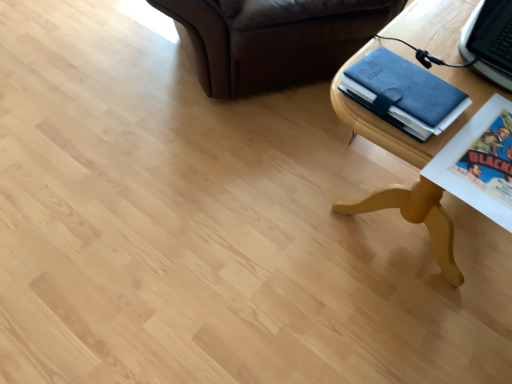
Question: Based on their sizes in the image, would you say wooden table at lower right is bigger or smaller than blue leather binder at upper right?

Choices:
 (A) small
 (B) big

Answer: (B)

Question: From the image's perspective, is wooden table at lower right above or below blue leather binder at upper right?

Choices:
 (A) below
 (B) above

Answer: (B)

Question: Would you say wooden table at lower right is inside or outside blue leather binder at upper right?

Choices:
 (A) inside
 (B) outside

Answer: (B)

Question: Considering the positions of point (350, 91) and point (407, 28), is point (350, 91) closer or farther from the camera than point (407, 28)?

Choices:
 (A) farther
 (B) closer

Answer: (B)

Question: Relative to wooden table at lower right, is blue leather binder at upper right in front or behind?

Choices:
 (A) behind
 (B) front

Answer: (A)

Question: In terms of width, does blue leather binder at upper right look wider or thinner when compared to wooden table at lower right?

Choices:
 (A) thin
 (B) wide

Answer: (A)

Question: From a real-world perspective, relative to wooden table at lower right, is blue leather binder at upper right vertically above or below?

Choices:
 (A) above
 (B) below

Answer: (A)